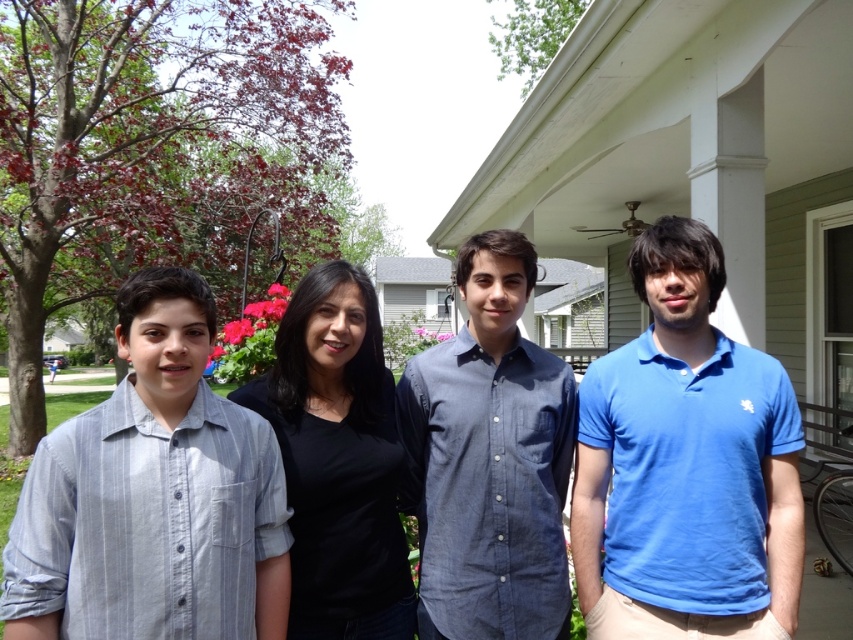
You are a photographer trying to capture a group photo of the blue cotton polo shirt at center and the black matte shirt at center. The minimum distance required for your camera to focus properly is 1 meter. Based on the scene description, will the camera be able to focus on both subjects simultaneously?

The blue cotton polo shirt at center is 83.10 centimeters away from the black matte shirt at center. Since 83.10 centimeters is less than 1 meter, the camera may struggle to focus on both subjects simultaneously as they are closer than the required minimum distance.

You are a photographer trying to capture a clear photo of both the light blue striped shirt at center and the black matte shirt at center. Which one will appear closer to the camera in the photo?

The light blue striped shirt at center will appear closer to the camera because it is positioned further to the viewer than the black matte shirt at center.